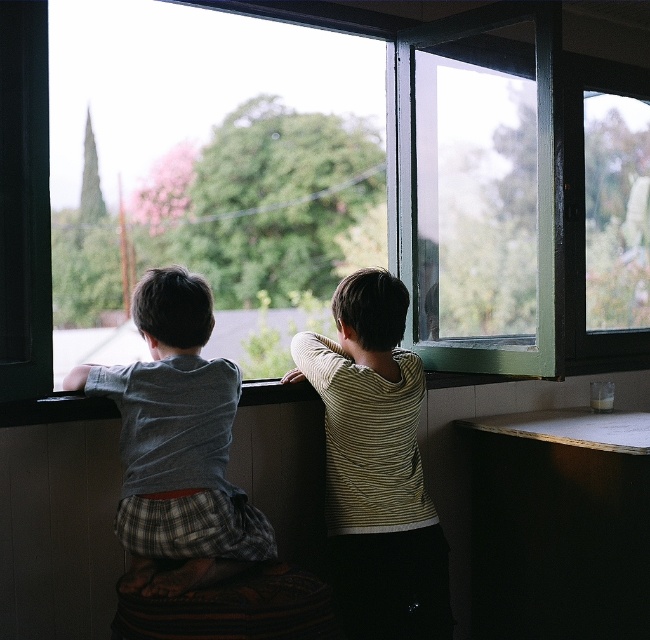
Question: Can you confirm if green glass window at center is bigger than striped cotton shirt at center?

Choices:
 (A) no
 (B) yes

Answer: (B)

Question: Can you confirm if green glass window at center is positioned above striped cotton shirt at center?

Choices:
 (A) no
 (B) yes

Answer: (B)

Question: Considering the relative positions of striped cotton shirt at center and gray cotton shirt at left in the image provided, where is striped cotton shirt at center located with respect to gray cotton shirt at left?

Choices:
 (A) left
 (B) right

Answer: (B)

Question: Based on their relative distances, which object is nearer to the gray cotton shirt at left?

Choices:
 (A) green glass window at center
 (B) striped cotton shirt at center

Answer: (B)

Question: Which object appears closest to the camera in this image?

Choices:
 (A) striped cotton shirt at center
 (B) gray cotton shirt at left

Answer: (B)

Question: Which point is closer to the camera?

Choices:
 (A) (367, 442)
 (B) (348, 13)
 (C) (188, 365)

Answer: (C)